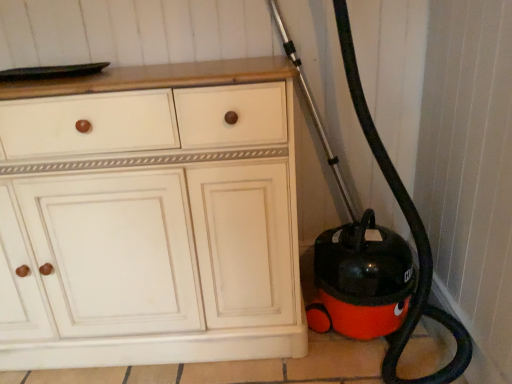
Question: Considering the relative positions of white wood cabinet at center and black rubber garden hose at right in the image provided, is white wood cabinet at center to the left of black rubber garden hose at right from the viewer's perspective?

Choices:
 (A) no
 (B) yes

Answer: (B)

Question: Is white wood cabinet at center behind black rubber garden hose at right?

Choices:
 (A) yes
 (B) no

Answer: (A)

Question: Could you tell me if white wood cabinet at center is turned towards black rubber garden hose at right?

Choices:
 (A) yes
 (B) no

Answer: (B)

Question: From a real-world perspective, is white wood cabinet at center below black rubber garden hose at right?

Choices:
 (A) yes
 (B) no

Answer: (A)

Question: Would you say white wood cabinet at center contains black rubber garden hose at right?

Choices:
 (A) no
 (B) yes

Answer: (A)

Question: Is white wood cabinet at center not within black rubber garden hose at right?

Choices:
 (A) no
 (B) yes

Answer: (B)

Question: From the image's perspective, would you say black rubber garden hose at right is positioned over white wood cabinet at center?

Choices:
 (A) yes
 (B) no

Answer: (A)

Question: From a real-world perspective, is black rubber garden hose at right over white wood cabinet at center?

Choices:
 (A) no
 (B) yes

Answer: (B)

Question: From the image's perspective, is black rubber garden hose at right below white wood cabinet at center?

Choices:
 (A) no
 (B) yes

Answer: (A)

Question: Can you see black rubber garden hose at right touching white wood cabinet at center?

Choices:
 (A) yes
 (B) no

Answer: (B)

Question: Can you confirm if black rubber garden hose at right is shorter than white wood cabinet at center?

Choices:
 (A) no
 (B) yes

Answer: (A)

Question: From a real-world perspective, does black rubber garden hose at right sit lower than white wood cabinet at center?

Choices:
 (A) no
 (B) yes

Answer: (A)

Question: Considering the positions of white wood cabinet at center and black rubber garden hose at right in the image, is white wood cabinet at center bigger or smaller than black rubber garden hose at right?

Choices:
 (A) big
 (B) small

Answer: (A)